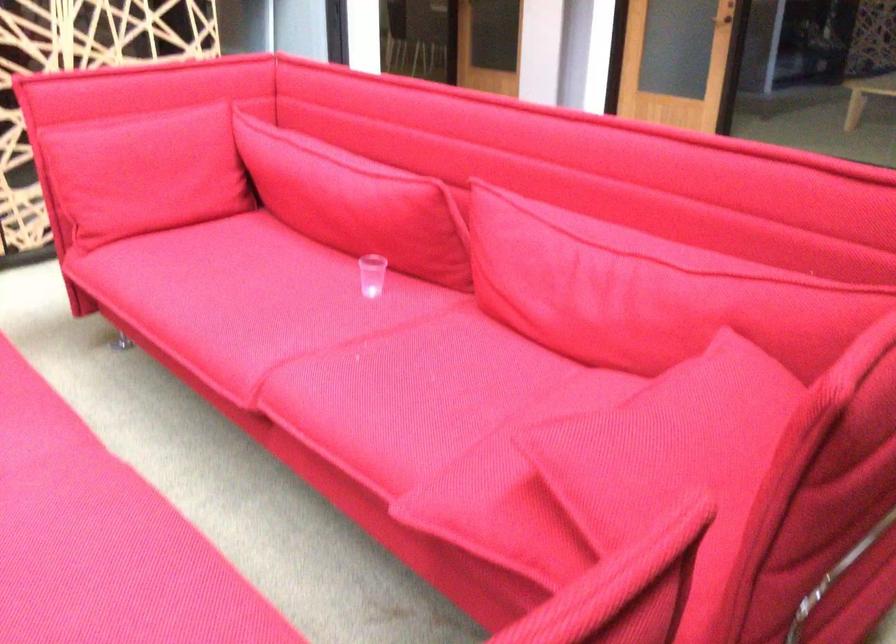
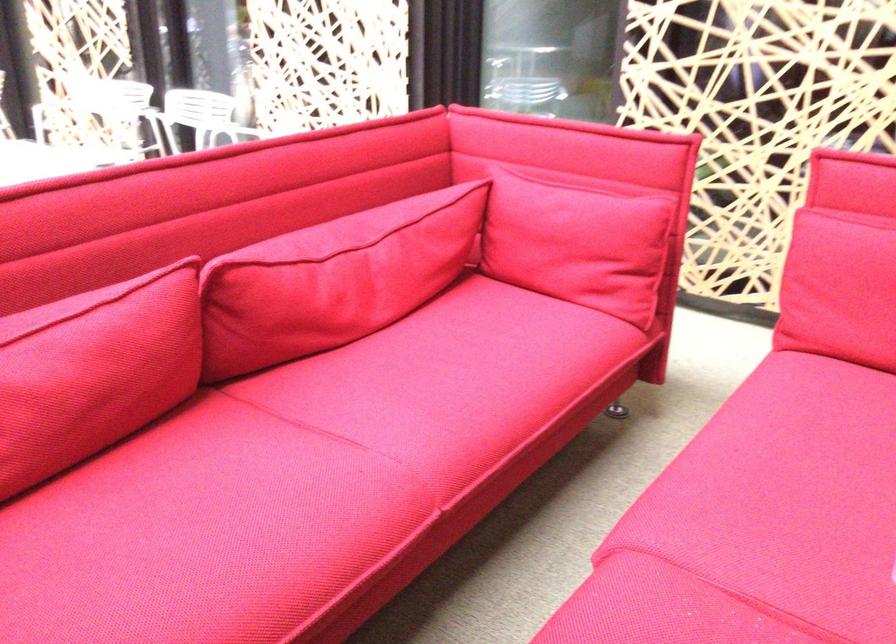
Where in the second image is the point corresponding to pixel 151 182 from the first image?

(840, 288)